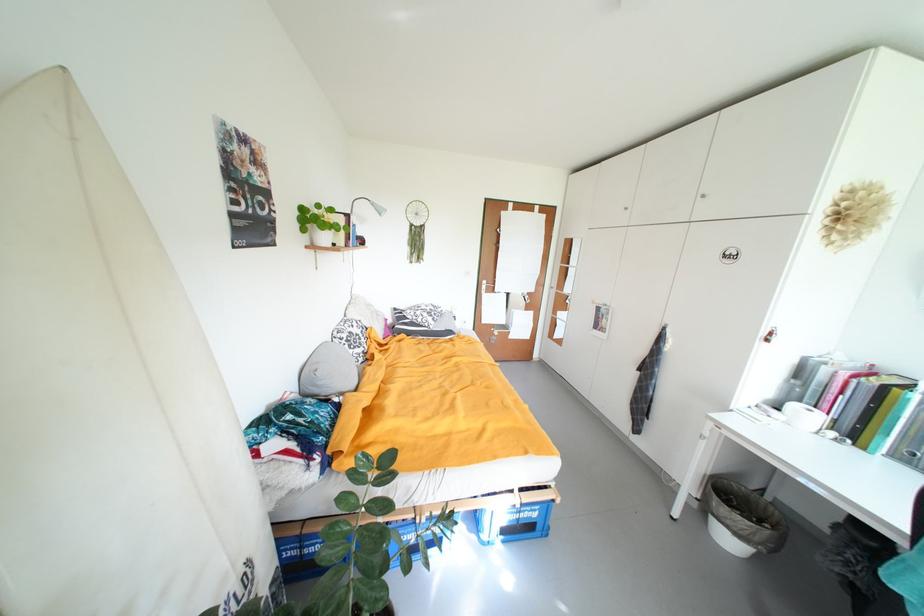
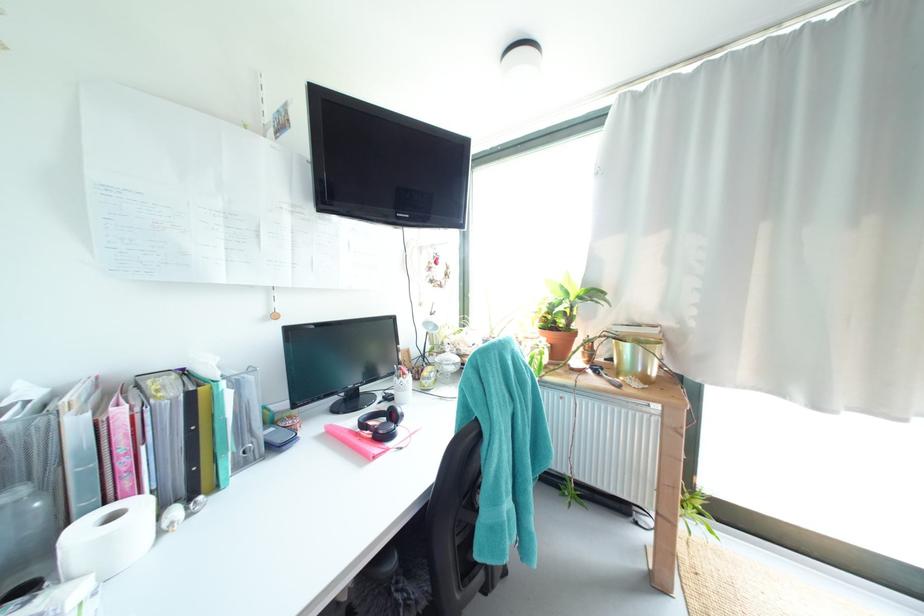
Find the pixel in the second image that matches point (841, 436) in the first image.

(185, 513)